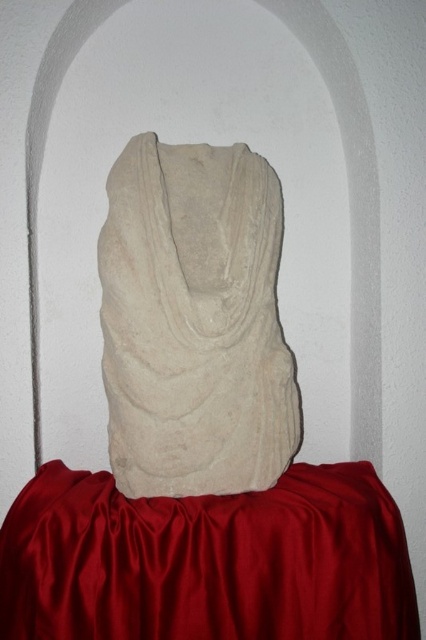
Question: Among these points, which one is farthest from the camera?

Choices:
 (A) (252, 483)
 (B) (258, 556)

Answer: (A)

Question: Is satin red tablecloth at center to the left of white stone bust at center from the viewer's perspective?

Choices:
 (A) no
 (B) yes

Answer: (A)

Question: In this image, where is satin red tablecloth at center located relative to white stone bust at center?

Choices:
 (A) left
 (B) right

Answer: (B)

Question: Which object is farther from the camera taking this photo?

Choices:
 (A) white stone bust at center
 (B) satin red tablecloth at center

Answer: (A)

Question: Can you confirm if satin red tablecloth at center is positioned to the right of white stone bust at center?

Choices:
 (A) no
 (B) yes

Answer: (B)